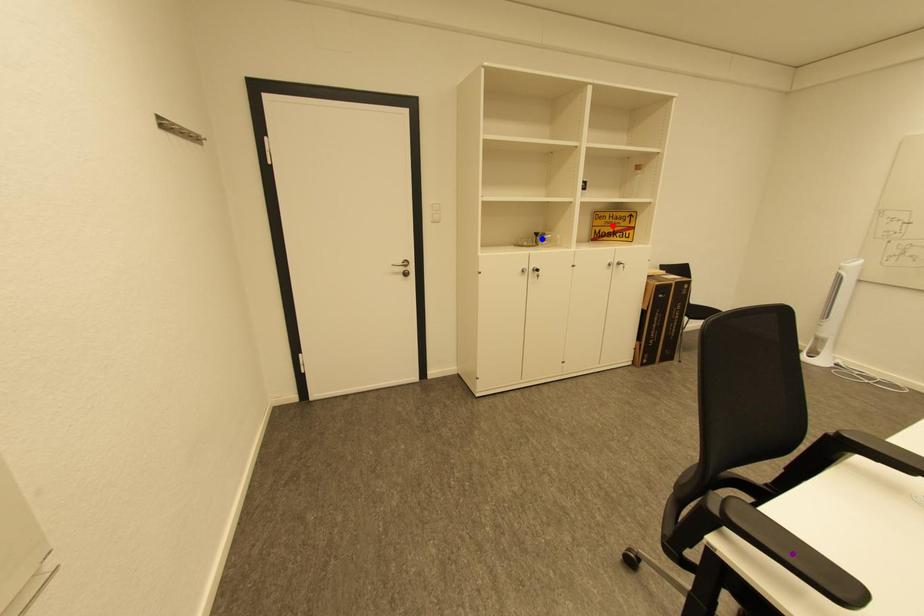
Order these from nearest to farthest:
A) purple point
B) red point
C) blue point

1. purple point
2. blue point
3. red point